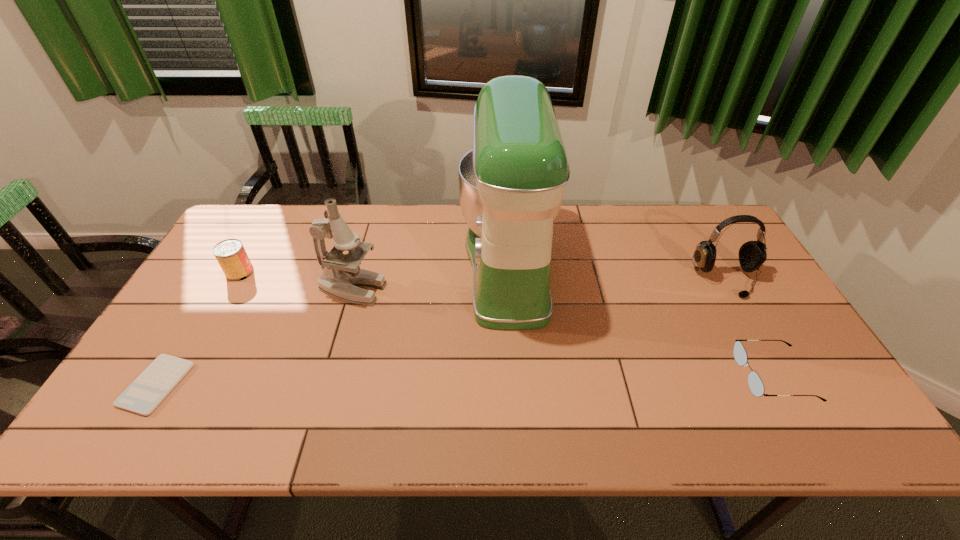
Where is `vacant space located 0.090m on the controls of the mixer`? The height and width of the screenshot is (540, 960). vacant space located 0.090m on the controls of the mixer is located at coordinates (431, 266).

You are a GUI agent. You are given a task and a screenshot of the screen. Output one action in this format:
    pyautogui.click(x=<x>, y=<y>)
    Task: Click on the free region located 0.390m on the right of the fifth shortest object
    
    Given the screenshot: What is the action you would take?
    pyautogui.click(x=519, y=289)

At what (x,y) coordinates should I click in order to perform the action: click on vacant region located with the microphone on the side of the fourth shortest object. Please return your answer as a coordinate pair (x, y). This screenshot has height=540, width=960. Looking at the image, I should click on (752, 325).

Where is `free region located on the back of the can`? free region located on the back of the can is located at coordinates (277, 206).

At what (x,y) coordinates should I click in order to perform the action: click on vacant region located 0.200m on the lenses of the spectacles. Please return your answer as a coordinate pair (x, y). The height and width of the screenshot is (540, 960). Looking at the image, I should click on (660, 375).

Where is `free region located 0.080m on the lenses of the spectacles`? This screenshot has height=540, width=960. free region located 0.080m on the lenses of the spectacles is located at coordinates (708, 375).

The width and height of the screenshot is (960, 540). Identify the location of vacant region located 0.110m on the lenses of the spectacles. (697, 375).

What are the coordinates of `free space located 0.400m on the back of the calculator` in the screenshot? It's located at (236, 253).

I want to click on object positioned at the far edge, so click(x=511, y=184).

Locate an element on the screen. This screenshot has width=960, height=540. object that is at the near edge is located at coordinates (151, 387).